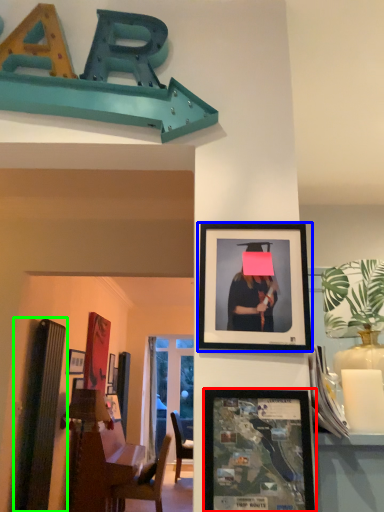
Question: Estimate the real-world distances between objects in this image. Which object is farther from picture frame (highlighted by a red box), picture frame (highlighted by a blue box) or bulletin board (highlighted by a green box)?

Choices:
 (A) picture frame
 (B) bulletin board

Answer: (B)